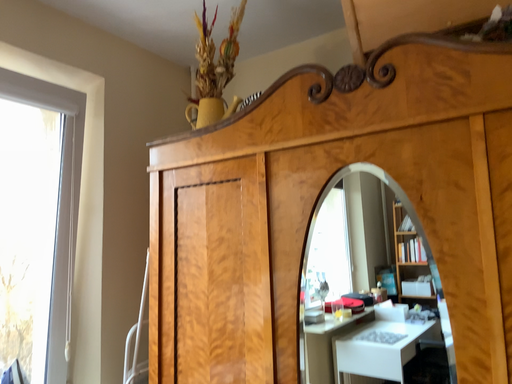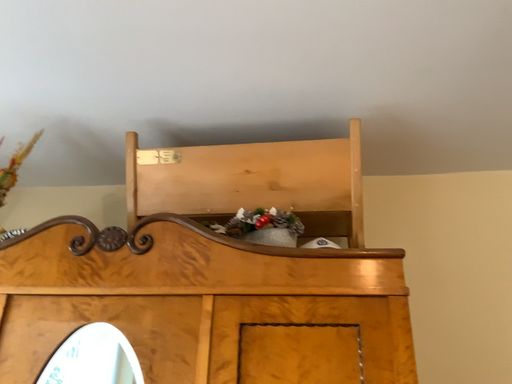
Question: How did the camera likely rotate when shooting the video?

Choices:
 (A) rotated upward
 (B) rotated downward

Answer: (A)